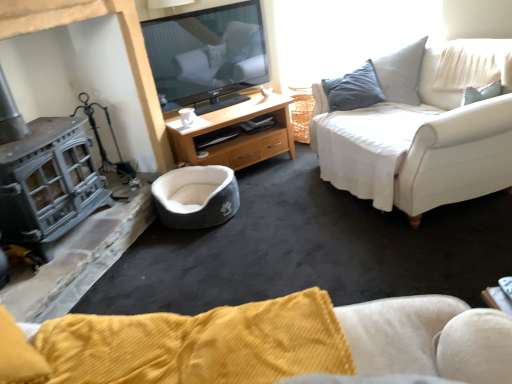
Question: Is white glossy coffee cup at center oriented away from wooden tv stand at center?

Choices:
 (A) yes
 (B) no

Answer: (B)

Question: Would you say white glossy coffee cup at center is a long distance from wooden tv stand at center?

Choices:
 (A) no
 (B) yes

Answer: (A)

Question: From the image's perspective, is white glossy coffee cup at center located above wooden tv stand at center?

Choices:
 (A) no
 (B) yes

Answer: (B)

Question: Is the position of white glossy coffee cup at center less distant than that of wooden tv stand at center?

Choices:
 (A) no
 (B) yes

Answer: (A)

Question: Is white glossy coffee cup at center in contact with wooden tv stand at center?

Choices:
 (A) yes
 (B) no

Answer: (B)

Question: From the image's perspective, relative to white fabric couch at right, is gray plush pet bed at center above or below?

Choices:
 (A) below
 (B) above

Answer: (A)

Question: Is gray plush pet bed at center taller or shorter than white fabric couch at right?

Choices:
 (A) tall
 (B) short

Answer: (B)

Question: Considering the positions of gray plush pet bed at center and white fabric couch at right in the image, is gray plush pet bed at center bigger or smaller than white fabric couch at right?

Choices:
 (A) big
 (B) small

Answer: (B)

Question: Does point (189, 198) appear closer or farther from the camera than point (411, 109)?

Choices:
 (A) farther
 (B) closer

Answer: (A)

Question: From the image's perspective, is white fabric couch at right above or below gray plush pet bed at center?

Choices:
 (A) above
 (B) below

Answer: (A)

Question: Which is correct: white fabric couch at right is inside gray plush pet bed at center, or outside of it?

Choices:
 (A) inside
 (B) outside

Answer: (B)

Question: Based on their positions, is white fabric couch at right located to the left or right of gray plush pet bed at center?

Choices:
 (A) right
 (B) left

Answer: (A)

Question: Considering the positions of white fabric couch at right and gray plush pet bed at center in the image, is white fabric couch at right wider or thinner than gray plush pet bed at center?

Choices:
 (A) wide
 (B) thin

Answer: (A)

Question: From a real-world perspective, is wooden tv stand at center positioned above or below white fabric couch at right?

Choices:
 (A) above
 (B) below

Answer: (B)

Question: Is wooden tv stand at center bigger or smaller than white fabric couch at right?

Choices:
 (A) big
 (B) small

Answer: (B)